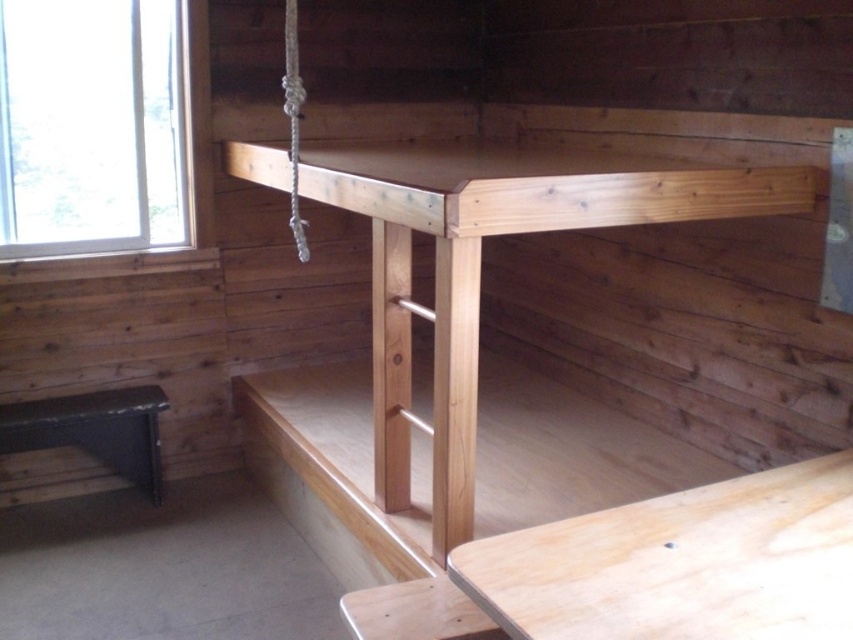
Is light wood/texture workbench at center closer to the viewer compared to black leather bench at lower left?

Yes.

Which is more to the right, light wood/texture workbench at center or black leather bench at lower left?

light wood/texture workbench at center

At what (x,y) coordinates should I click in order to perform the action: click on light wood/texture workbench at center. Please return your answer as a coordinate pair (x, y). This screenshot has width=853, height=640. Looking at the image, I should click on (680, 563).

Can you confirm if natural wood bunk bed at center is thinner than transparent glass window at upper left?

In fact, natural wood bunk bed at center might be wider than transparent glass window at upper left.

This screenshot has height=640, width=853. What do you see at coordinates (479, 269) in the screenshot?
I see `natural wood bunk bed at center` at bounding box center [479, 269].

Where is `natural wood bunk bed at center`? This screenshot has height=640, width=853. natural wood bunk bed at center is located at coordinates (479, 269).

The width and height of the screenshot is (853, 640). What do you see at coordinates (680, 563) in the screenshot? I see `light wood/texture workbench at center` at bounding box center [680, 563].

Can you confirm if light wood/texture workbench at center is positioned to the left of transparent glass window at upper left?

No, light wood/texture workbench at center is not to the left of transparent glass window at upper left.

Locate an element on the screen. The height and width of the screenshot is (640, 853). light wood/texture workbench at center is located at coordinates (680, 563).

The width and height of the screenshot is (853, 640). I want to click on light wood/texture workbench at center, so click(x=680, y=563).